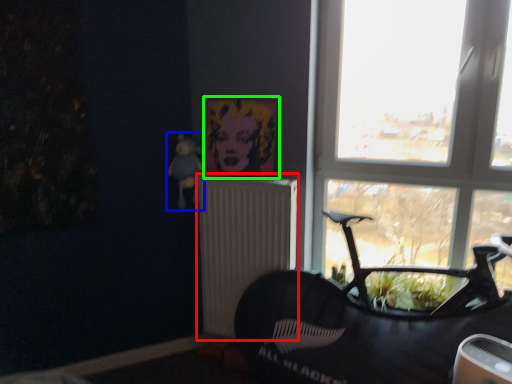
Question: Estimate the real-world distances between objects in this image. Which object is closer to radiator (highlighted by a red box), toy (highlighted by a blue box) or picture frame (highlighted by a green box)?

Choices:
 (A) toy
 (B) picture frame

Answer: (B)